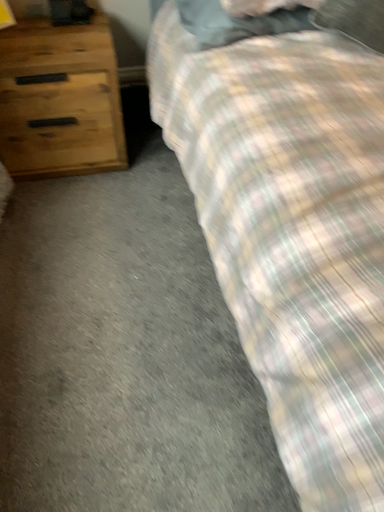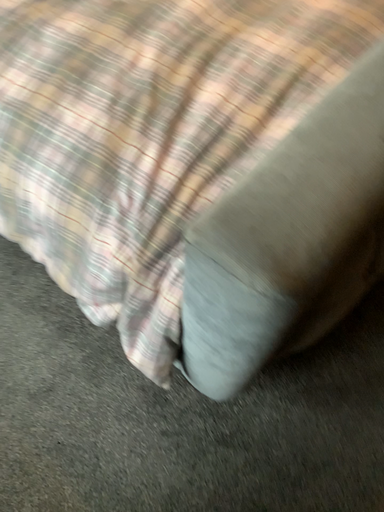
Question: How did the camera likely rotate when shooting the video?

Choices:
 (A) rotated left
 (B) rotated right

Answer: (B)